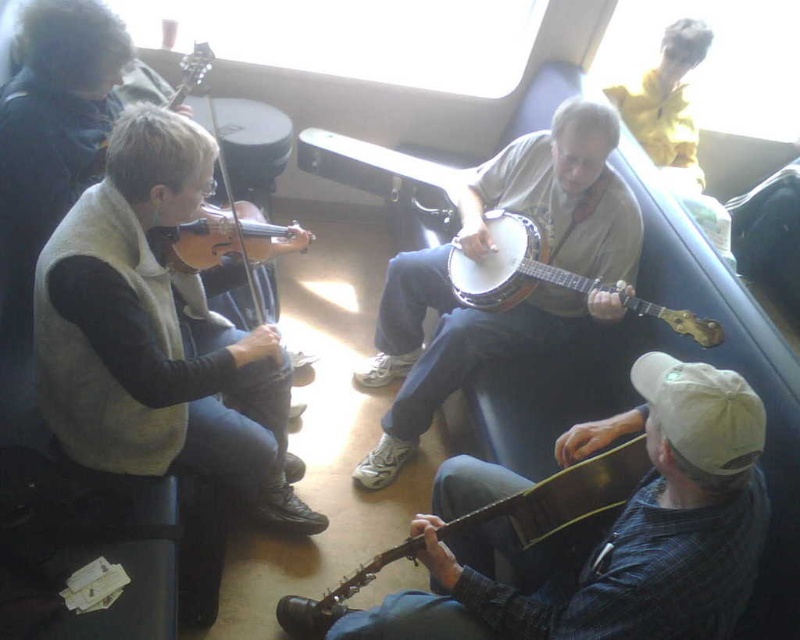
Question: Does light brown wood banjo at center lie behind wooden banjo at lower right?

Choices:
 (A) yes
 (B) no

Answer: (A)

Question: Considering the real-world distances, which object is closest to the wooden banjo at center?

Choices:
 (A) wooden banjo at lower right
 (B) wooden violin at left

Answer: (A)

Question: Does light brown wood banjo at center have a lesser width compared to wooden banjo at center?

Choices:
 (A) yes
 (B) no

Answer: (B)

Question: Estimate the real-world distances between objects in this image. Which object is farther from the light brown wood violin at upper left?

Choices:
 (A) wooden banjo at lower right
 (B) light brown wood banjo at center
 (C) wooden banjo at center

Answer: (A)

Question: Estimate the real-world distances between objects in this image. Which object is farther from the light brown wood violin at upper left?

Choices:
 (A) wooden banjo at lower right
 (B) white wooden banjo at center
 (C) wooden banjo at center

Answer: (A)

Question: Observing the image, what is the correct spatial positioning of light brown wood banjo at center in reference to light brown wood violin at upper left?

Choices:
 (A) above
 (B) below

Answer: (B)